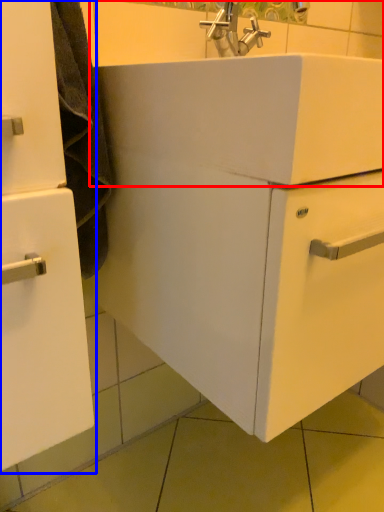
Question: Which point is further to the camera, sink (highlighted by a red box) or bathroom cabinet (highlighted by a blue box)?

Choices:
 (A) sink
 (B) bathroom cabinet

Answer: (B)